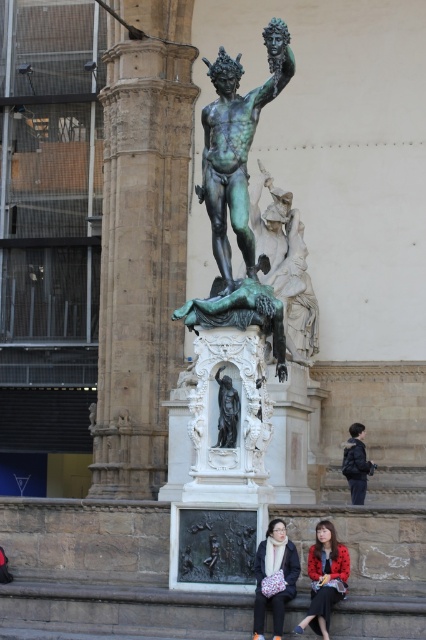
You are a photographer setting up for an outdoor event in the public square with the bronze statue of Perseus. You need to place two items for a photo shoot. The red textured coat at lower center and the dark blue jacket at lower right must be positioned such that they are exactly 20 meters apart. Given their current distance, can you achieve this without moving the statue?

The red textured coat at lower center is currently 19.15 meters from the dark blue jacket at lower right. To reach the required 20 meters, you would need to move one or both items by approximately 0.85 meters. Since the statue itself is fixed, you can adjust the positions of the coat and jacket around it to meet the distance requirement.

You are a photographer standing in the public square where the statue of Perseus is located. You want to take a photo of the statue without any people in the frame. You notice two people wearing a red textured coat at lower center and a dark blue jacket at lower right. Which person would you ask to move so that the statue is fully visible?

You should ask the person wearing the red textured coat at lower center to move because they are in front of the dark blue jacket at lower right, blocking the view of the statue.